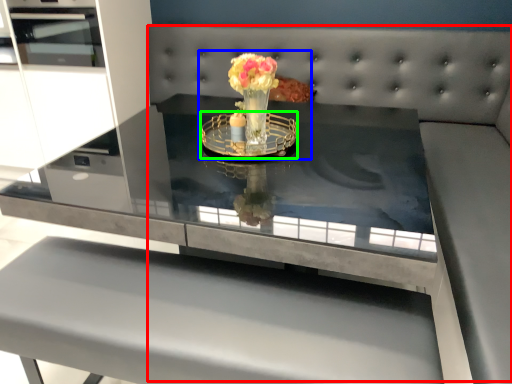
Question: Considering the real-world distances, which object is farthest from couch (highlighted by a red box)? floral arrangement (highlighted by a blue box) or glass plate (highlighted by a green box)?

Choices:
 (A) floral arrangement
 (B) glass plate

Answer: (A)